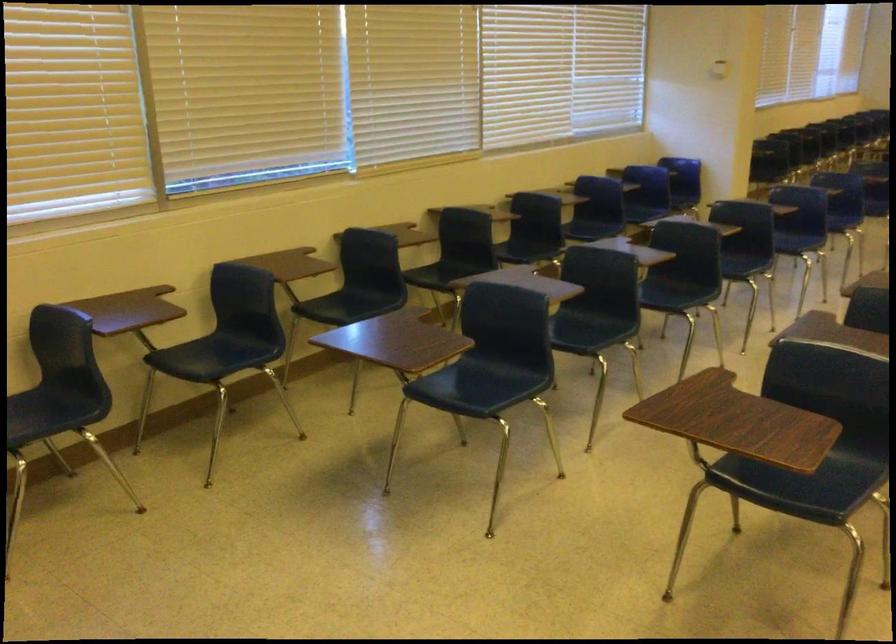
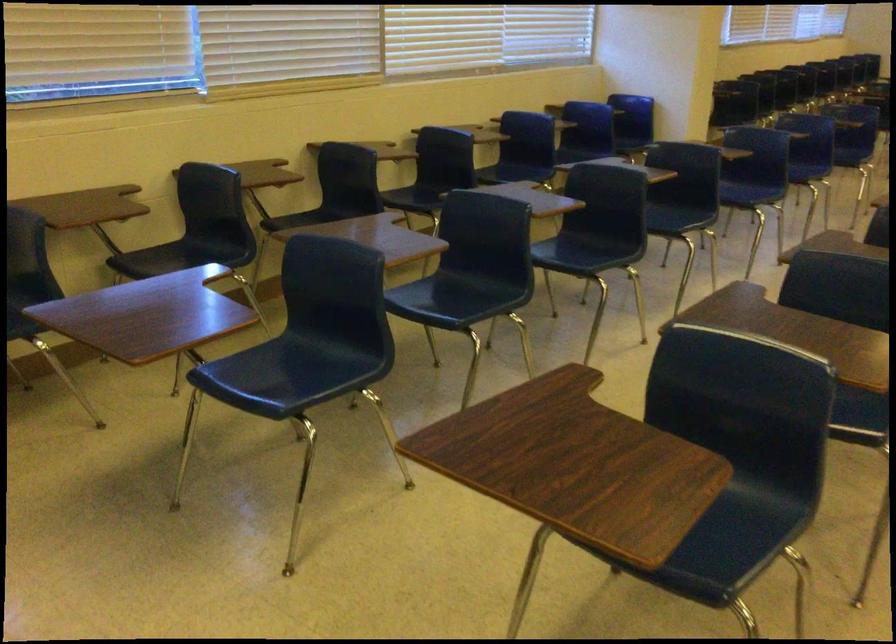
In the second image, find the point that corresponds to pixel 345 299 in the first image.

(181, 257)